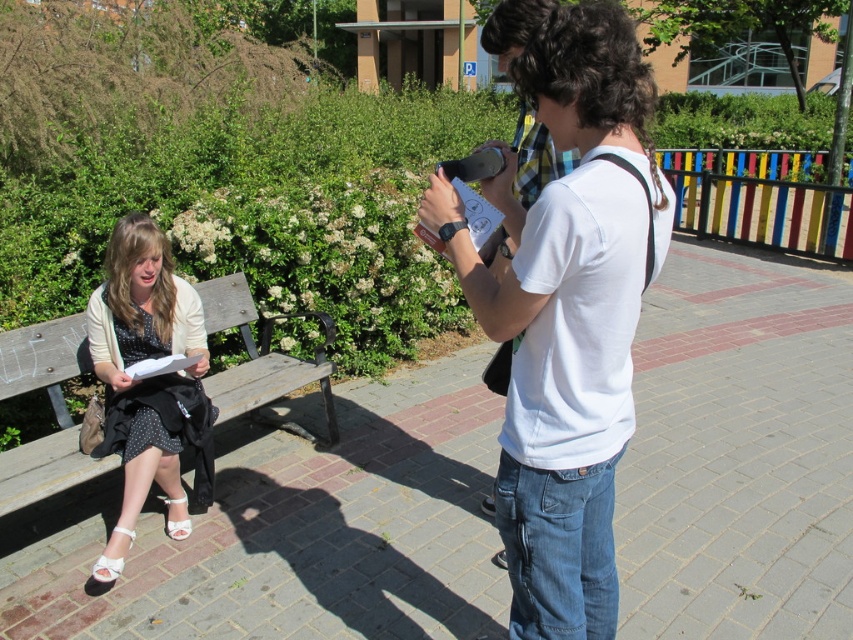
Is matte white blouse at left positioned in front of wooden bench at left?

Yes, matte white blouse at left is closer to the viewer.

At what (x,y) coordinates should I click in order to perform the action: click on matte white blouse at left. Please return your answer as a coordinate pair (x, y). Looking at the image, I should click on (148, 384).

Is white cotton shirt at center thinner than wooden bench at left?

Yes.

Is the position of white cotton shirt at center less distant than that of wooden bench at left?

Yes, white cotton shirt at center is closer to the viewer.

Who is more forward, [543,544] or [322,355]?

Point [543,544] is in front.

Find the location of a particular element. The width and height of the screenshot is (853, 640). white cotton shirt at center is located at coordinates (567, 316).

Is white cotton shirt at center thinner than matte white blouse at left?

In fact, white cotton shirt at center might be wider than matte white blouse at left.

Between white cotton shirt at center and matte white blouse at left, which one appears on the right side from the viewer's perspective?

Positioned to the right is white cotton shirt at center.

Is point (575, 19) closer to camera compared to point (210, 502)?

Yes, it is in front of point (210, 502).

The height and width of the screenshot is (640, 853). I want to click on white cotton shirt at center, so click(x=567, y=316).